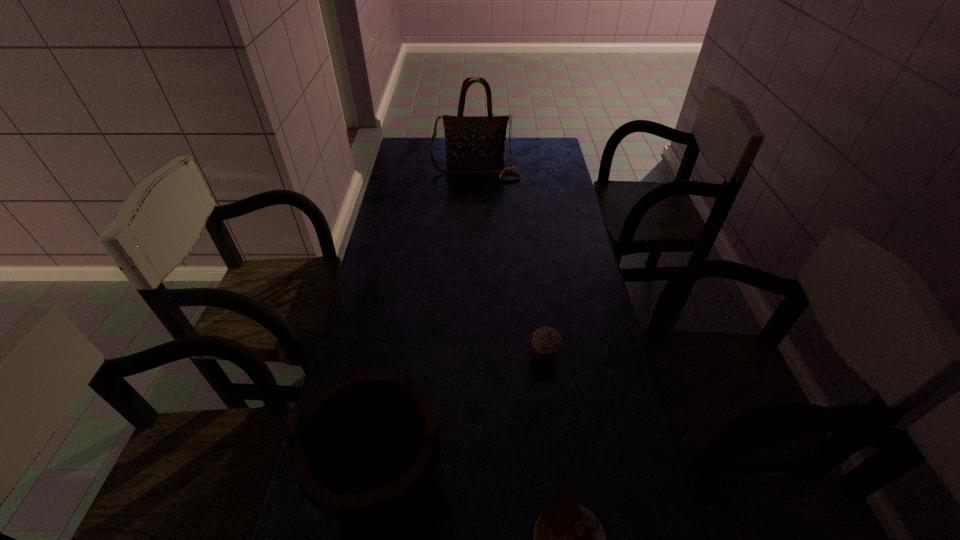
Where is `free space at the left edge of the desktop`? free space at the left edge of the desktop is located at coordinates 410,199.

The height and width of the screenshot is (540, 960). Identify the location of free space at the right edge of the desktop. (613, 384).

Identify the location of blank area at the far left corner. (401, 163).

You are a GUI agent. You are given a task and a screenshot of the screen. Output one action in this format:
    pyautogui.click(x=<x>, y=<y>)
    Task: Click on the vacant space at the far right corner of the desktop
    This screenshot has height=540, width=960.
    Given the screenshot: What is the action you would take?
    pyautogui.click(x=544, y=155)

Where is `free space between the tallest object and the third nearest object`? free space between the tallest object and the third nearest object is located at coordinates 510,263.

This screenshot has height=540, width=960. In order to click on unoccupied area between the farthest object and the second farthest object in this screenshot , I will do `click(510, 263)`.

Locate an element on the screen. This screenshot has width=960, height=540. free area in between the third nearest object and the farthest object is located at coordinates (510, 263).

Point out which object is positioned as the third nearest to the third shortest object. Please provide its 2D coordinates. Your answer should be formatted as a tuple, i.e. [(x, y)], where the tuple contains the x and y coordinates of a point satisfying the conditions above.

[(472, 142)]

Image resolution: width=960 pixels, height=540 pixels. I want to click on the third closest object relative to the shortest object, so click(x=472, y=142).

Locate an element on the screen. vacant region that satisfies the following two spatial constraints: 1. on the front-facing side of the third tallest object; 2. on the right side of the farthest object is located at coordinates (472, 356).